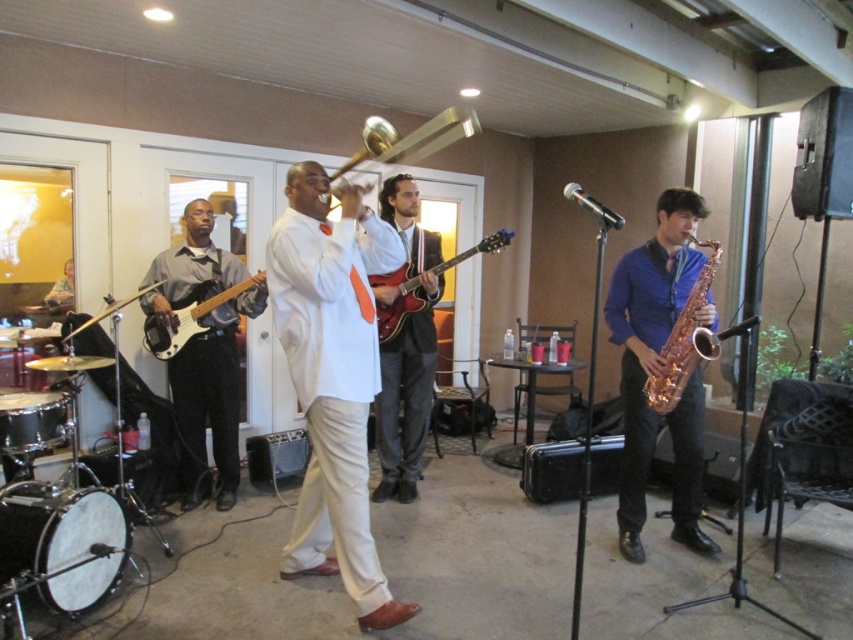
Question: Among these objects, which one is nearest to the camera?

Choices:
 (A) glossy wood guitar at center
 (B) black drum at lower left
 (C) rose gold saxophone at right
 (D) matte black bass guitar at left

Answer: (B)

Question: Which of the following is the closest to the observer?

Choices:
 (A) (340, 356)
 (B) (416, 300)

Answer: (A)

Question: Does matte black bass guitar at left appear on the left side of white drumhead at lower left?

Choices:
 (A) no
 (B) yes

Answer: (A)

Question: Which point is closer to the camera taking this photo?

Choices:
 (A) (15, 432)
 (B) (61, 493)
 (C) (289, 301)

Answer: (C)

Question: Is matte black bass guitar at left in front of black drum at lower left?

Choices:
 (A) yes
 (B) no

Answer: (B)

Question: Where is matte black bass guitar at left located in relation to matte black electric guitar at left in the image?

Choices:
 (A) right
 (B) left

Answer: (B)